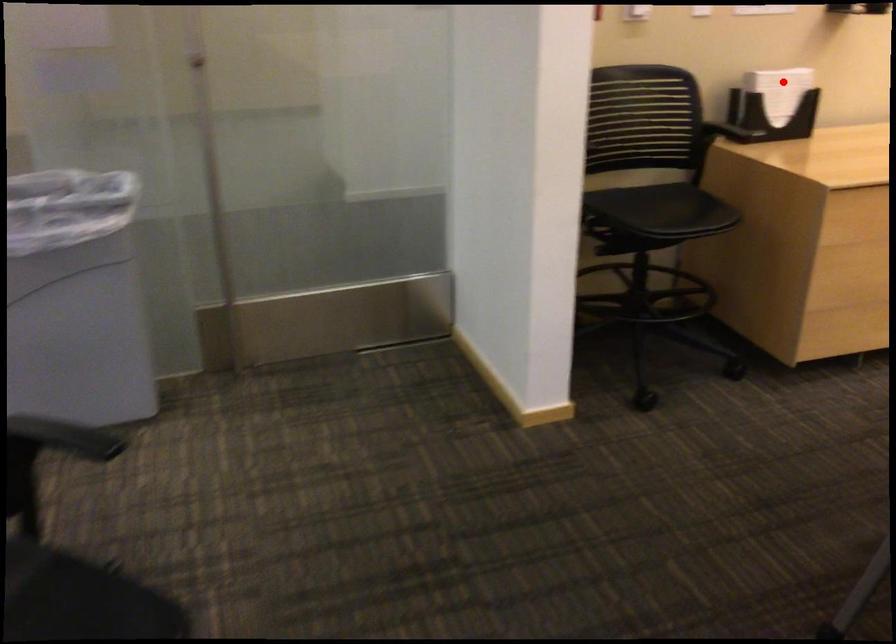
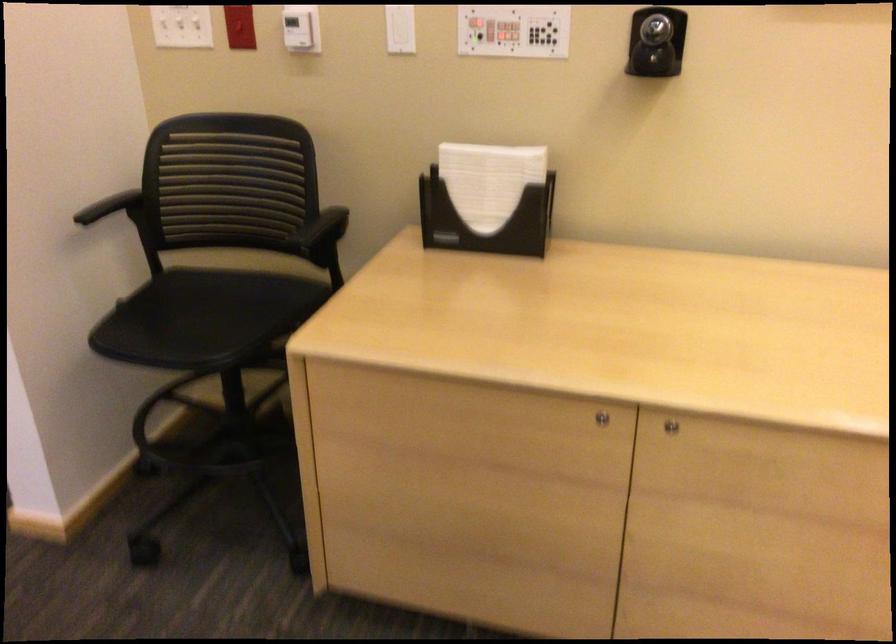
Where in the second image is the point corresponding to the highlighted location from the first image?

(488, 180)